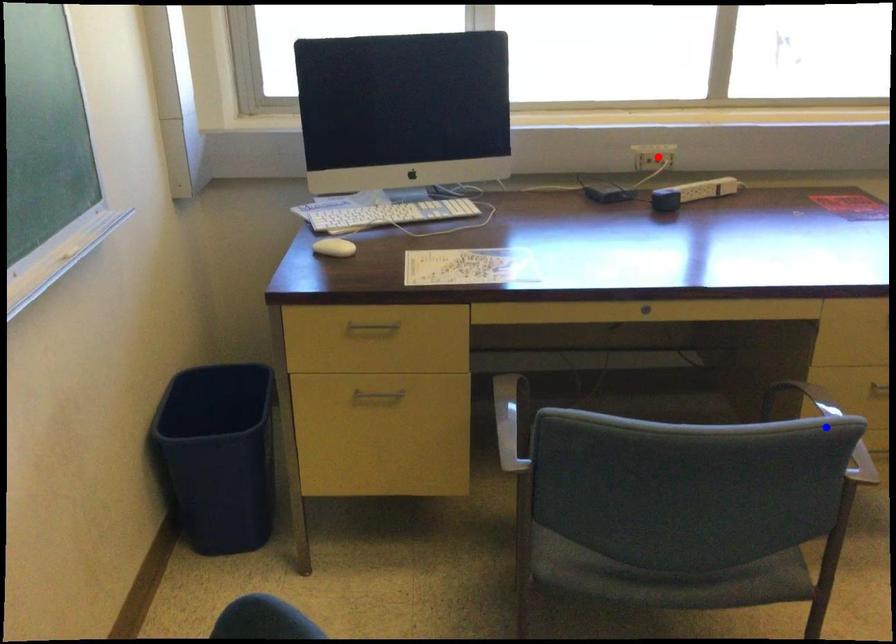
Question: In the image, two points are highlighted. Which point is nearer to the camera? Reply with the corresponding letter.

Choices:
 (A) blue point
 (B) red point

Answer: (A)